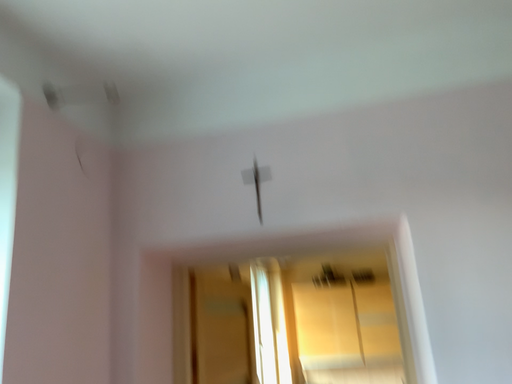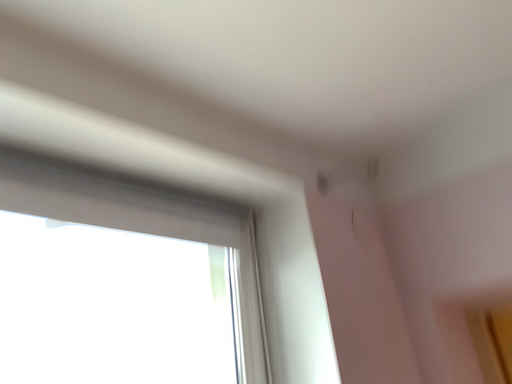
Question: Which way did the camera rotate in the video?

Choices:
 (A) rotated left
 (B) rotated right

Answer: (A)